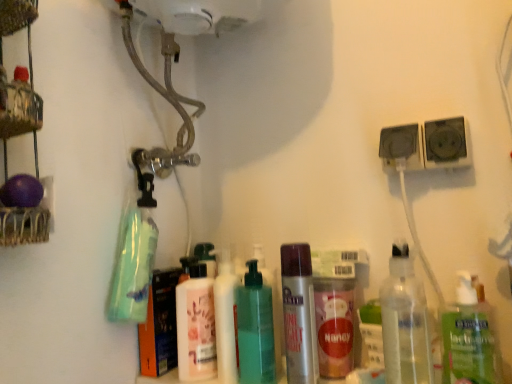
Identify the location of clear plastic bottle at center-right, the fourth bottle in the left-to-right sequence. Image resolution: width=512 pixels, height=384 pixels. (405, 323).

The width and height of the screenshot is (512, 384). What do you see at coordinates (401, 147) in the screenshot?
I see `black plastic socket at upper right, the first speaker from the left` at bounding box center [401, 147].

Image resolution: width=512 pixels, height=384 pixels. In order to click on clear plastic bottle at lower right, which is the 5th bottle from left to right in this screenshot , I will do pos(469,339).

Find the location of a particular element. Image resolution: width=512 pixels, height=384 pixels. silver metallic spray can at center, which is counted as the third bottle, starting from the right is located at coordinates (298, 314).

I want to click on clear plastic bottle at center-right, the fourth bottle in the left-to-right sequence, so click(x=405, y=323).

From a real-world perspective, is pink matte lotion at center, which is the first bottle from left to right, below black plastic socket at upper right, the second speaker positioned from the right?

Yes, from a real-world perspective, pink matte lotion at center, which is the first bottle from left to right, is under black plastic socket at upper right, the second speaker positioned from the right.

Could you tell me if pink matte lotion at center, which is the first bottle from left to right, is facing black plastic socket at upper right, the second speaker positioned from the right?

No, pink matte lotion at center, which is the first bottle from left to right, is not oriented towards black plastic socket at upper right, the second speaker positioned from the right.

Is point (183, 336) closer or farther from the camera than point (398, 151)?

Point (183, 336) appears to be farther away from the viewer than point (398, 151).

Is pink matte lotion at center, which is the first bottle from left to right, behind black plastic socket at upper right, the second speaker positioned from the right?

Yes, the depth of pink matte lotion at center, which is the first bottle from left to right, is greater than that of black plastic socket at upper right, the second speaker positioned from the right.

From the image's perspective, is silver metallic spray can at center, which is counted as the third bottle, starting from the right, located beneath white glossy pump bottle at center, acting as the second cleaning product starting from the left?

Incorrect, from the image's perspective, silver metallic spray can at center, which is counted as the third bottle, starting from the right, is higher than white glossy pump bottle at center, acting as the second cleaning product starting from the left.

Would you say silver metallic spray can at center, which is counted as the third bottle, starting from the right, is inside or outside white glossy pump bottle at center, acting as the second cleaning product starting from the left?

silver metallic spray can at center, which is counted as the third bottle, starting from the right, exists outside the volume of white glossy pump bottle at center, acting as the second cleaning product starting from the left.

From a real-world perspective, is silver metallic spray can at center, which is the 3th bottle from left to right, under white glossy pump bottle at center, acting as the 1th cleaning product starting from the right?

Incorrect, from a real-world perspective, silver metallic spray can at center, which is the 3th bottle from left to right, is higher than white glossy pump bottle at center, acting as the 1th cleaning product starting from the right.

Considering the sizes of objects silver metallic spray can at center, which is counted as the third bottle, starting from the right, and white glossy pump bottle at center, acting as the second cleaning product starting from the left, in the image provided, who is taller, silver metallic spray can at center, which is counted as the third bottle, starting from the right, or white glossy pump bottle at center, acting as the second cleaning product starting from the left,?

white glossy pump bottle at center, acting as the second cleaning product starting from the left.

In the scene shown: Which of these two, clear plastic bottle at lower right, positioned as the first bottle in right-to-left order, or black plastic socket at upper right, the first speaker from the left, is wider?

With larger width is clear plastic bottle at lower right, positioned as the first bottle in right-to-left order.

Is clear plastic bottle at lower right, positioned as the first bottle in right-to-left order, aimed at black plastic socket at upper right, the first speaker from the left?

No, clear plastic bottle at lower right, positioned as the first bottle in right-to-left order, is not turned towards black plastic socket at upper right, the first speaker from the left.

Is clear plastic bottle at lower right, positioned as the first bottle in right-to-left order, far from black plastic socket at upper right, the second speaker positioned from the right?

No, clear plastic bottle at lower right, positioned as the first bottle in right-to-left order, is not far away from black plastic socket at upper right, the second speaker positioned from the right.

Is clear plastic bottle at lower right, which is the 5th bottle from left to right, positioned beyond the bounds of black plastic socket at upper right, the second speaker positioned from the right?

Yes, clear plastic bottle at lower right, which is the 5th bottle from left to right, is located beyond the bounds of black plastic socket at upper right, the second speaker positioned from the right.

Which object is positioned more to the left, green matte bottle at left, arranged as the 1th cleaning product when viewed from the left, or black plastic socket at upper right, which is counted as the 1th speaker, starting from the right?

From the viewer's perspective, green matte bottle at left, arranged as the 1th cleaning product when viewed from the left, appears more on the left side.

Considering the relative sizes of green matte bottle at left, which ranks as the 2th cleaning product in right-to-left order, and black plastic socket at upper right, the 2th speaker when ordered from left to right, in the image provided, is green matte bottle at left, which ranks as the 2th cleaning product in right-to-left order, thinner than black plastic socket at upper right, the 2th speaker when ordered from left to right,?

Incorrect, the width of green matte bottle at left, which ranks as the 2th cleaning product in right-to-left order, is not less than that of black plastic socket at upper right, the 2th speaker when ordered from left to right.

Consider the image. From the image's perspective, which one is positioned higher, green matte bottle at left, which ranks as the 2th cleaning product in right-to-left order, or black plastic socket at upper right, which is counted as the 1th speaker, starting from the right?

black plastic socket at upper right, which is counted as the 1th speaker, starting from the right, appears higher in the image.

Can you confirm if green matte bottle at left, arranged as the 1th cleaning product when viewed from the left, is shorter than black plastic socket at upper right, which is counted as the 1th speaker, starting from the right?

In fact, green matte bottle at left, arranged as the 1th cleaning product when viewed from the left, may be taller than black plastic socket at upper right, which is counted as the 1th speaker, starting from the right.

Considering the sizes of objects green translucent bottle at center, which is the fourth bottle in right-to-left order, and clear plastic bottle at lower right, positioned as the first bottle in right-to-left order, in the image provided, who is thinner, green translucent bottle at center, which is the fourth bottle in right-to-left order, or clear plastic bottle at lower right, positioned as the first bottle in right-to-left order,?

Thinner between the two is clear plastic bottle at lower right, positioned as the first bottle in right-to-left order.

Does green translucent bottle at center, which is the fourth bottle in right-to-left order, appear on the left side of clear plastic bottle at lower right, which is the 5th bottle from left to right?

Yes.

Could you measure the distance between green translucent bottle at center, which appears as the second bottle when viewed from the left, and clear plastic bottle at lower right, positioned as the first bottle in right-to-left order?

green translucent bottle at center, which appears as the second bottle when viewed from the left, and clear plastic bottle at lower right, positioned as the first bottle in right-to-left order, are 11.65 inches apart from each other.

Considering the relative positions of pink matte lotion at center, acting as the 5th bottle starting from the right, and green translucent bottle at center, which appears as the second bottle when viewed from the left, in the image provided, is pink matte lotion at center, acting as the 5th bottle starting from the right, to the right of green translucent bottle at center, which appears as the second bottle when viewed from the left, from the viewer's perspective?

No, pink matte lotion at center, acting as the 5th bottle starting from the right, is not to the right of green translucent bottle at center, which appears as the second bottle when viewed from the left.

Considering the relative sizes of pink matte lotion at center, which is the first bottle from left to right, and green translucent bottle at center, which appears as the second bottle when viewed from the left, in the image provided, is pink matte lotion at center, which is the first bottle from left to right, thinner than green translucent bottle at center, which appears as the second bottle when viewed from the left,?

No.

Considering the sizes of pink matte lotion at center, which is the first bottle from left to right, and green translucent bottle at center, which appears as the second bottle when viewed from the left, in the image, is pink matte lotion at center, which is the first bottle from left to right, taller or shorter than green translucent bottle at center, which appears as the second bottle when viewed from the left,?

Clearly, pink matte lotion at center, which is the first bottle from left to right, is shorter compared to green translucent bottle at center, which appears as the second bottle when viewed from the left.

I want to click on the 2nd bottle located above the pink matte lotion at center, which is the first bottle from left to right (from a real-world perspective), so click(255, 329).

Considering the sizes of silver metallic spray can at center, which is counted as the third bottle, starting from the right, and green matte bottle at left, which ranks as the 2th cleaning product in right-to-left order, in the image, is silver metallic spray can at center, which is counted as the third bottle, starting from the right, taller or shorter than green matte bottle at left, which ranks as the 2th cleaning product in right-to-left order,?

Considering their sizes, silver metallic spray can at center, which is counted as the third bottle, starting from the right, has less height than green matte bottle at left, which ranks as the 2th cleaning product in right-to-left order.

Considering the sizes of objects silver metallic spray can at center, which is the 3th bottle from left to right, and green matte bottle at left, which ranks as the 2th cleaning product in right-to-left order, in the image provided, who is thinner, silver metallic spray can at center, which is the 3th bottle from left to right, or green matte bottle at left, which ranks as the 2th cleaning product in right-to-left order,?

silver metallic spray can at center, which is the 3th bottle from left to right.

Can you tell me how much silver metallic spray can at center, which is the 3th bottle from left to right, and green matte bottle at left, arranged as the 1th cleaning product when viewed from the left, differ in facing direction?

3.28 degrees.

The width and height of the screenshot is (512, 384). Find the location of `the 2nd cleaning product to the left of the silver metallic spray can at center, which is the 3th bottle from left to right, counting from the anchor's position`. the 2nd cleaning product to the left of the silver metallic spray can at center, which is the 3th bottle from left to right, counting from the anchor's position is located at coordinates (133, 267).

From the image's perspective, which bottle is the 5th one below the black plastic socket at upper right, the first speaker from the left? Please provide its 2D coordinates.

[(196, 326)]

Locate an element on the screen. This screenshot has width=512, height=384. the 2nd bottle counting from the right side of the white glossy pump bottle at center, acting as the 1th cleaning product starting from the right is located at coordinates (298, 314).

Looking at this image, based on their spatial positions, is black plastic socket at upper right, the 2th speaker when ordered from left to right, or silver metallic spray can at center, which is counted as the third bottle, starting from the right, further from green translucent bottle at center, which is the fourth bottle in right-to-left order?

Among the two, black plastic socket at upper right, the 2th speaker when ordered from left to right, is located further to green translucent bottle at center, which is the fourth bottle in right-to-left order.

Considering their positions, is white glossy pump bottle at center, acting as the second cleaning product starting from the left, positioned further to pink matte lotion at center, which is the first bottle from left to right, than green translucent bottle at center, which is the fourth bottle in right-to-left order?

green translucent bottle at center, which is the fourth bottle in right-to-left order, lies further to pink matte lotion at center, which is the first bottle from left to right, than the other object.

Based on their spatial positions, is green matte bottle at left, which ranks as the 2th cleaning product in right-to-left order, or clear plastic bottle at lower right, which is the 5th bottle from left to right, closer to green translucent bottle at center, which is the fourth bottle in right-to-left order?

Among the two, green matte bottle at left, which ranks as the 2th cleaning product in right-to-left order, is located nearer to green translucent bottle at center, which is the fourth bottle in right-to-left order.

From the image, which object appears to be nearer to green translucent bottle at center, which appears as the second bottle when viewed from the left, silver metallic spray can at center, which is the 3th bottle from left to right, or clear plastic bottle at center-right, the second bottle in the right-to-left sequence?

silver metallic spray can at center, which is the 3th bottle from left to right.

When comparing their distances from black plastic socket at upper right, the second speaker positioned from the right, does pink matte lotion at center, acting as the 5th bottle starting from the right, or clear plastic bottle at lower right, positioned as the first bottle in right-to-left order, seem further?

pink matte lotion at center, acting as the 5th bottle starting from the right, lies further to black plastic socket at upper right, the second speaker positioned from the right, than the other object.

From the picture: Which object lies further to the anchor point black plastic socket at upper right, which is counted as the 1th speaker, starting from the right, clear plastic bottle at center-right, the fourth bottle in the left-to-right sequence, or black plastic socket at upper right, the first speaker from the left?

clear plastic bottle at center-right, the fourth bottle in the left-to-right sequence.

Based on their spatial positions, is white glossy pump bottle at center, acting as the second cleaning product starting from the left, or green translucent bottle at center, which appears as the second bottle when viewed from the left, closer to clear plastic bottle at lower right, which is the 5th bottle from left to right?

green translucent bottle at center, which appears as the second bottle when viewed from the left.

From the image, which object appears to be farther from clear plastic bottle at lower right, positioned as the first bottle in right-to-left order, black plastic socket at upper right, the 2th speaker when ordered from left to right, or clear plastic bottle at center-right, the second bottle in the right-to-left sequence?

The object further to clear plastic bottle at lower right, positioned as the first bottle in right-to-left order, is black plastic socket at upper right, the 2th speaker when ordered from left to right.

This screenshot has width=512, height=384. In order to click on bottle between pink matte lotion at center, acting as the 5th bottle starting from the right, and silver metallic spray can at center, which is the 3th bottle from left to right in this screenshot , I will do `click(255, 329)`.

Locate an element on the screen. The width and height of the screenshot is (512, 384). speaker located between green matte bottle at left, which ranks as the 2th cleaning product in right-to-left order, and black plastic socket at upper right, which is counted as the 1th speaker, starting from the right, in the left-right direction is located at coordinates (401, 147).

Image resolution: width=512 pixels, height=384 pixels. I want to click on cleaning product between pink matte lotion at center, acting as the 5th bottle starting from the right, and black plastic socket at upper right, which is counted as the 1th speaker, starting from the right, from left to right, so click(x=226, y=318).

At what (x,y) coordinates should I click in order to perform the action: click on speaker between white glossy pump bottle at center, acting as the 1th cleaning product starting from the right, and black plastic socket at upper right, which is counted as the 1th speaker, starting from the right, in the horizontal direction. Please return your answer as a coordinate pair (x, y). The height and width of the screenshot is (384, 512). Looking at the image, I should click on (401, 147).